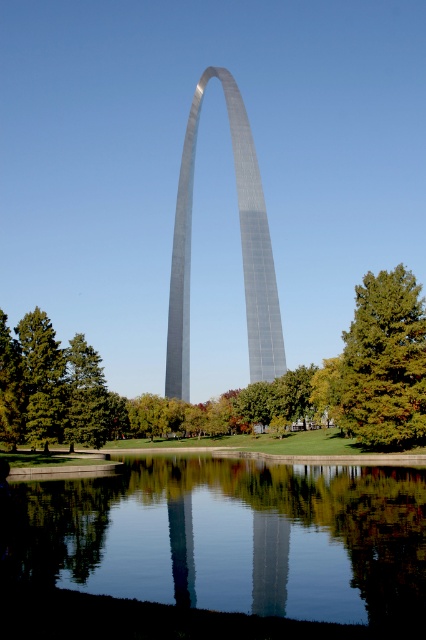
Between transparent glass water at center and green matte tree at lower left, which one is positioned lower?

green matte tree at lower left is below.

Consider the image. Is transparent glass water at center above green matte tree at lower left?

Correct, transparent glass water at center is located above green matte tree at lower left.

Identify the location of transparent glass water at center. This screenshot has width=426, height=640. (218, 545).

Is point (190, 225) farther from camera compared to point (34, 392)?

Yes, point (190, 225) is behind point (34, 392).

Where is `shiny metallic arch at center`? The height and width of the screenshot is (640, 426). shiny metallic arch at center is located at coordinates (241, 250).

The image size is (426, 640). Identify the location of shiny metallic arch at center. (241, 250).

Between green matte tree at lower right and green matte tree at lower left, which one appears on the left side from the viewer's perspective?

green matte tree at lower left is more to the left.

Does green matte tree at lower right have a lesser height compared to green matte tree at lower left?

Indeed, green matte tree at lower right has a lesser height compared to green matte tree at lower left.

Between point (394, 400) and point (40, 337), which one is positioned behind?

The point (40, 337) is behind.

Locate an element on the screen. The image size is (426, 640). green matte tree at lower right is located at coordinates (383, 362).